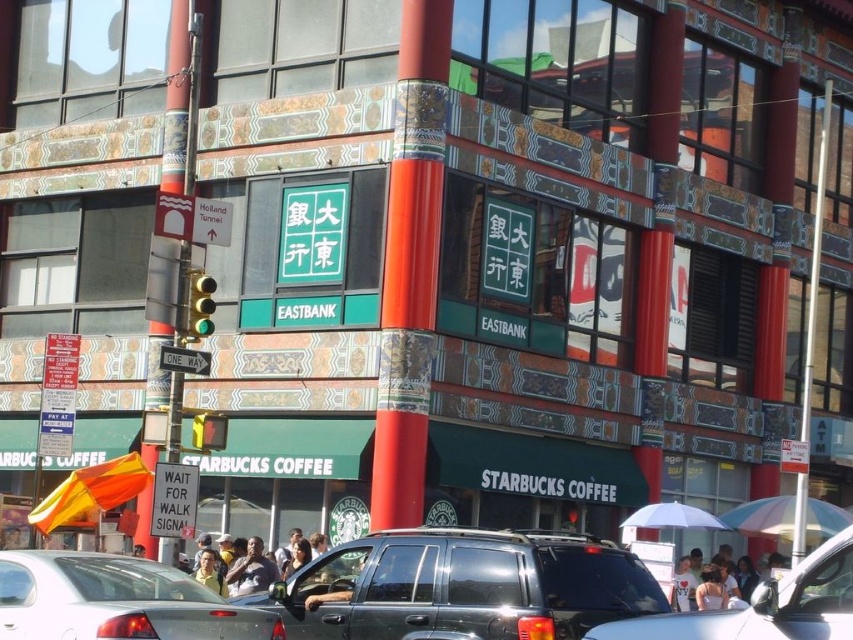
You are driving a car and need to park between the shiny black suv at center and the metallic pole at left. Can your car fit in the space between them?

The shiny black suv at center is wider than the metallic pole at left, so the space between them may be too narrow for your car to fit comfortably. Check the exact measurements before attempting to park.

You are a pedestrian standing at the Starbucks Coffee shop with a green awning. You see a point marked at coordinates (x=234, y=513). What object is located at that point?

The point at coordinates (x=234, y=513) indicates an orange fabric umbrella at center.

You are a pedestrian waiting at the crosswalk and see the rainbow striped umbrella at lower right and the orange fabric umbrella at center. Which umbrella is closer to the crosswalk?

The rainbow striped umbrella at lower right is closer to the crosswalk because it is positioned to the right of the orange fabric umbrella at center, which is further away from the crosswalk.